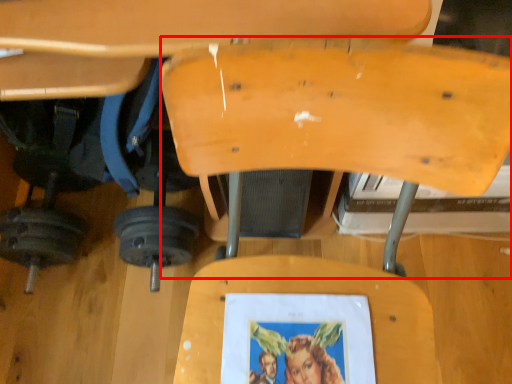
Question: Where is swivel chair (annotated by the red box) located in relation to barbell in the image?

Choices:
 (A) right
 (B) left

Answer: (A)